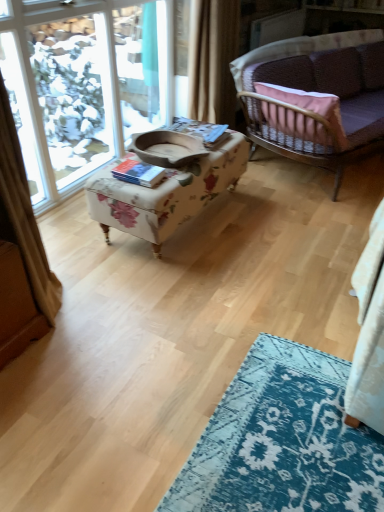
Question: Is velvet purple couch at upper right closer to camera compared to floral fabric ottoman at center?

Choices:
 (A) yes
 (B) no

Answer: (B)

Question: Can you confirm if velvet purple couch at upper right is smaller than floral fabric ottoman at center?

Choices:
 (A) yes
 (B) no

Answer: (B)

Question: Does velvet purple couch at upper right have a greater height compared to floral fabric ottoman at center?

Choices:
 (A) yes
 (B) no

Answer: (A)

Question: From the image's perspective, is velvet purple couch at upper right under floral fabric ottoman at center?

Choices:
 (A) yes
 (B) no

Answer: (B)

Question: From a real-world perspective, is velvet purple couch at upper right located higher than floral fabric ottoman at center?

Choices:
 (A) no
 (B) yes

Answer: (B)

Question: Is clear glass window at upper left taller or shorter than floral fabric ottoman at center?

Choices:
 (A) tall
 (B) short

Answer: (A)

Question: From a real-world perspective, is clear glass window at upper left positioned above or below floral fabric ottoman at center?

Choices:
 (A) above
 (B) below

Answer: (A)

Question: From the image's perspective, is clear glass window at upper left positioned above or below floral fabric ottoman at center?

Choices:
 (A) above
 (B) below

Answer: (A)

Question: In the image, is clear glass window at upper left on the left side or the right side of floral fabric ottoman at center?

Choices:
 (A) right
 (B) left

Answer: (B)

Question: Considering the positions of beige fabric curtain at upper center and velvet purple couch at upper right in the image, is beige fabric curtain at upper center wider or thinner than velvet purple couch at upper right?

Choices:
 (A) thin
 (B) wide

Answer: (A)

Question: Considering the positions of point (210, 37) and point (266, 53), is point (210, 37) closer or farther from the camera than point (266, 53)?

Choices:
 (A) farther
 (B) closer

Answer: (B)

Question: Would you say beige fabric curtain at upper center is to the left or to the right of velvet purple couch at upper right in the picture?

Choices:
 (A) right
 (B) left

Answer: (B)

Question: In terms of height, does beige fabric curtain at upper center look taller or shorter compared to velvet purple couch at upper right?

Choices:
 (A) tall
 (B) short

Answer: (A)

Question: From the image's perspective, is floral fabric ottoman at center above or below beige fabric curtain at upper center?

Choices:
 (A) below
 (B) above

Answer: (A)

Question: Based on their positions, is floral fabric ottoman at center located to the left or right of beige fabric curtain at upper center?

Choices:
 (A) right
 (B) left

Answer: (B)